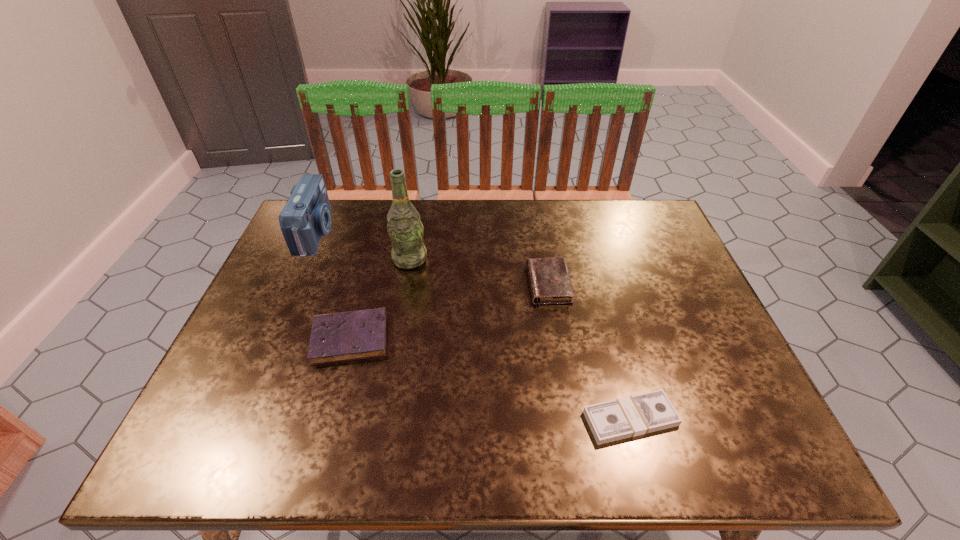
Find the location of `vacant region that satisfies the following two spatial constraints: 1. on the lens of the camera; 2. on the left side of the left diary`. vacant region that satisfies the following two spatial constraints: 1. on the lens of the camera; 2. on the left side of the left diary is located at coordinates (269, 338).